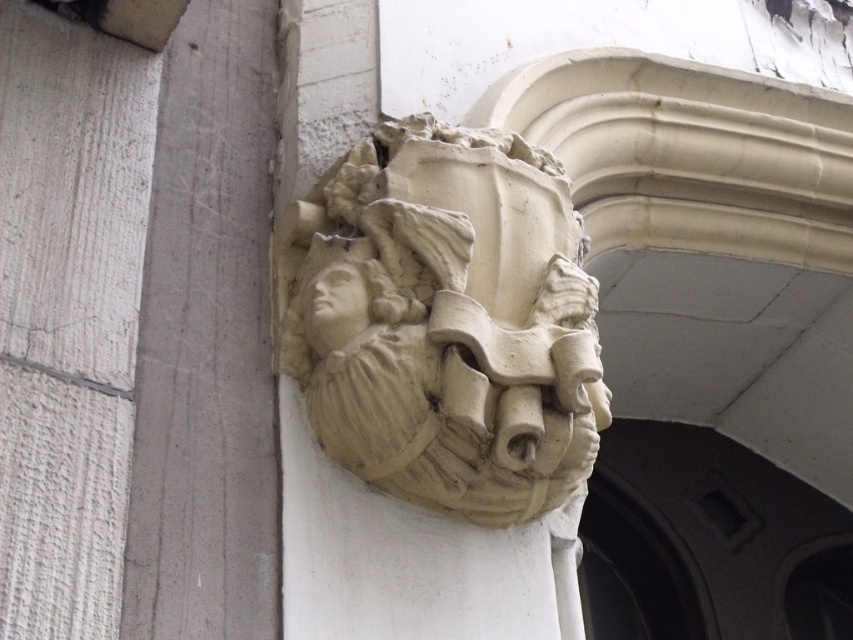
The width and height of the screenshot is (853, 640). What do you see at coordinates (451, 323) in the screenshot?
I see `beige stone sculpture at center` at bounding box center [451, 323].

Image resolution: width=853 pixels, height=640 pixels. I want to click on beige stone sculpture at center, so click(x=451, y=323).

Is white stone carving at upper left taller than matte stone head at center?

Indeed, white stone carving at upper left has a greater height compared to matte stone head at center.

Is the position of white stone carving at upper left more distant than that of matte stone head at center?

No, white stone carving at upper left is closer to the viewer.

The height and width of the screenshot is (640, 853). I want to click on white stone carving at upper left, so click(x=206, y=342).

Is beige stone sculpture at center smaller than matte stone head at center?

No.

Which of these two, beige stone sculpture at center or matte stone head at center, stands shorter?

Standing shorter between the two is matte stone head at center.

The width and height of the screenshot is (853, 640). Find the location of `beige stone sculpture at center`. beige stone sculpture at center is located at coordinates (451, 323).